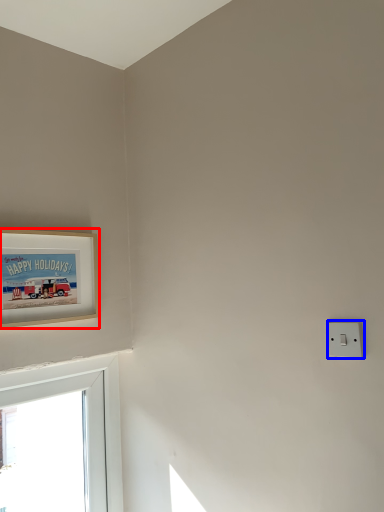
Question: Which object is closer to the camera taking this photo, picture frame (highlighted by a red box) or light switch (highlighted by a blue box)?

Choices:
 (A) picture frame
 (B) light switch

Answer: (B)